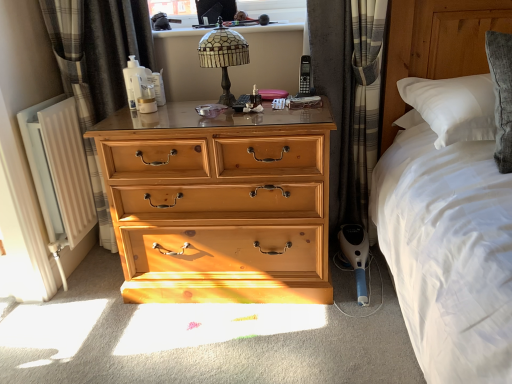
Identify the location of free spot in front of gray plaid curtain at left, which appears as the 2th curtain when viewed from the right. Image resolution: width=512 pixels, height=384 pixels. (105, 292).